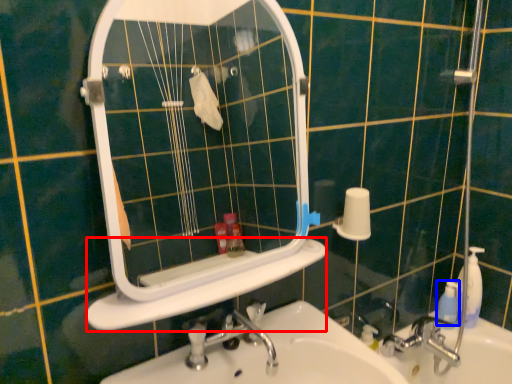
Question: Which point is further to the camera, ledge (highlighted by a red box) or mouthwash (highlighted by a blue box)?

Choices:
 (A) ledge
 (B) mouthwash

Answer: (B)